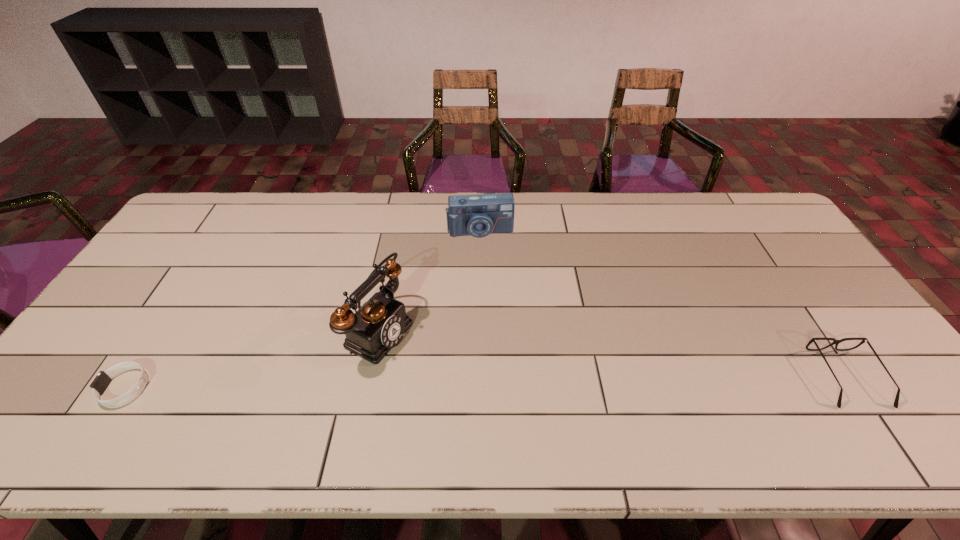
This screenshot has height=540, width=960. In order to click on vacant area that lies between the second object from right to left and the wristband in this screenshot , I will do `click(302, 309)`.

At what (x,y) coordinates should I click in order to perform the action: click on empty space between the camera and the wristband. Please return your answer as a coordinate pair (x, y). Looking at the image, I should click on click(x=302, y=309).

You are a GUI agent. You are given a task and a screenshot of the screen. Output one action in this format:
    pyautogui.click(x=<x>, y=<y>)
    Task: Click on the free spot between the third object from left to right and the spectacles
    The image size is (960, 540).
    Given the screenshot: What is the action you would take?
    pyautogui.click(x=663, y=305)

This screenshot has width=960, height=540. Identify the location of free space that is in between the spectacles and the farthest object. (663, 305).

You are a GUI agent. You are given a task and a screenshot of the screen. Output one action in this format:
    pyautogui.click(x=<x>, y=<y>)
    Task: Click on the free spot between the camera and the telephone
    Image resolution: width=960 pixels, height=540 pixels.
    Given the screenshot: What is the action you would take?
    pyautogui.click(x=430, y=281)

Identify the location of vacant space that is in between the second shortest object and the leftmost object. The width and height of the screenshot is (960, 540). (486, 383).

Where is `empty space that is in between the telephone and the shortest object`? empty space that is in between the telephone and the shortest object is located at coordinates (252, 359).

Where is `vacant space that's between the tallest object and the shortest object`? This screenshot has width=960, height=540. vacant space that's between the tallest object and the shortest object is located at coordinates (252, 359).

Where is `the third closest object to the third object from left to right`? the third closest object to the third object from left to right is located at coordinates (103, 379).

Identify the location of object that stands as the second closest to the second object from right to left. (836, 342).